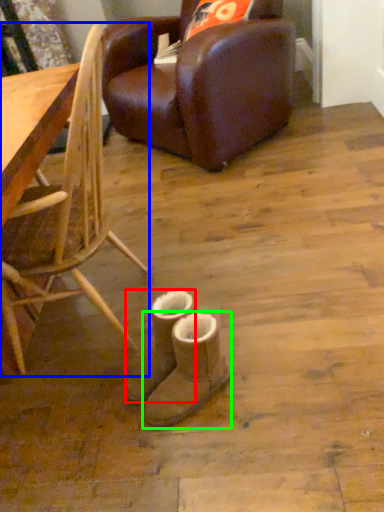
Question: Based on their relative distances, which object is farther from footwear (highlighted by a red box)? Choose from chair (highlighted by a blue box) and footwear (highlighted by a green box).

Choices:
 (A) chair
 (B) footwear

Answer: (A)